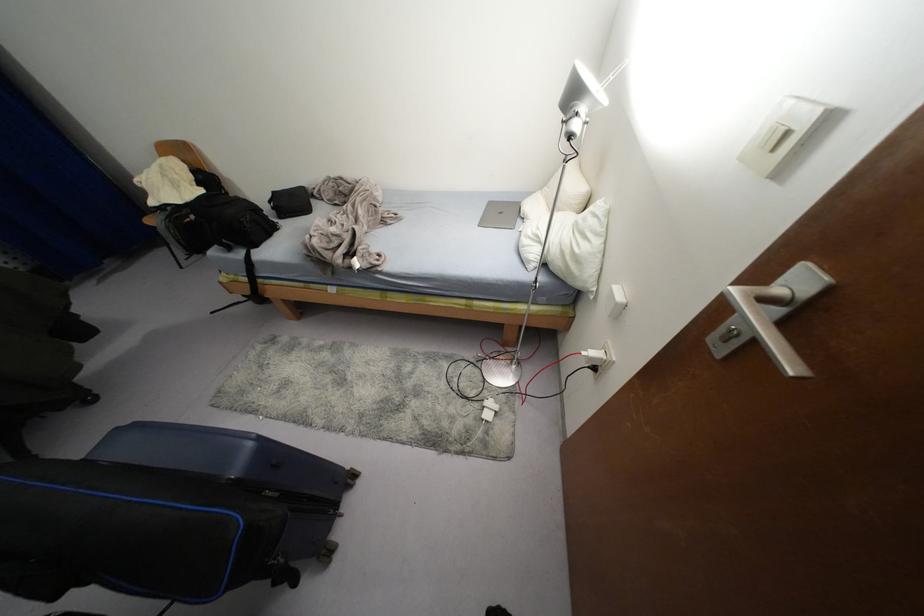
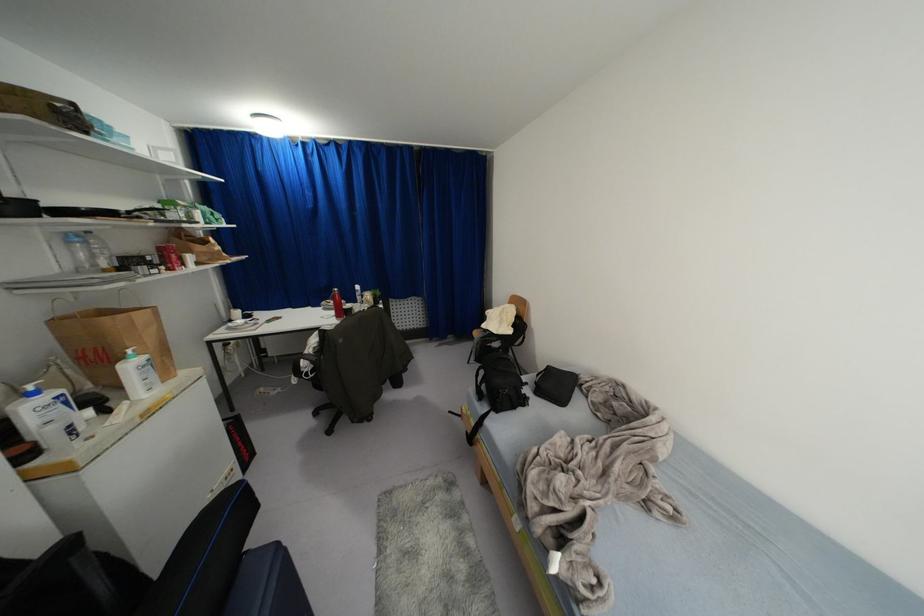
Question: The camera is either moving clockwise (left) or counter-clockwise (right) around the object. The first image is from the beginning of the video and the second image is from the end. Is the camera moving left or right when shooting the video?

Choices:
 (A) Left
 (B) Right

Answer: (B)